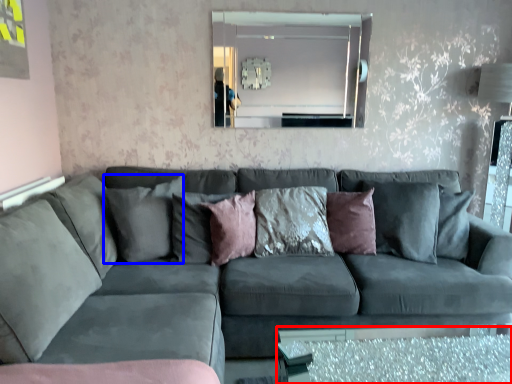
Question: Which object appears closest to the camera in this image, glass table (highlighted by a red box) or pillow (highlighted by a blue box)?

Choices:
 (A) glass table
 (B) pillow

Answer: (A)